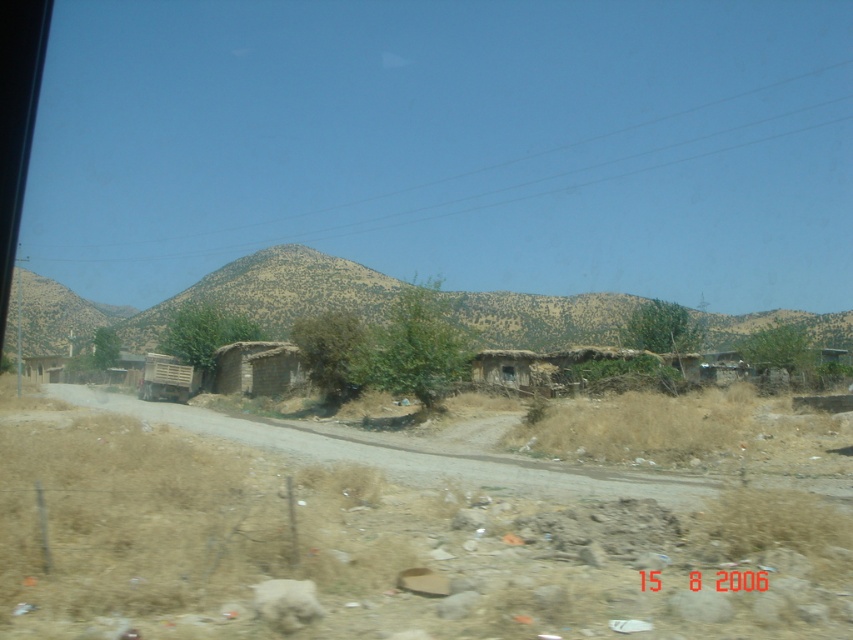
Question: Does brown textured mountain at center lie behind brown dirt track at center?

Choices:
 (A) yes
 (B) no

Answer: (A)

Question: Can you confirm if brown textured mountain at center is smaller than brown mud hut at center?

Choices:
 (A) no
 (B) yes

Answer: (A)

Question: Which object is the farthest from the brown dirt track at center?

Choices:
 (A) brown textured mountain at center
 (B) brown mud hut at center

Answer: (A)

Question: Which point appears farthest from the camera in this image?

Choices:
 (A) (332, 435)
 (B) (299, 364)

Answer: (B)

Question: Is brown dirt track at center positioned at the back of brown mud hut at center?

Choices:
 (A) no
 (B) yes

Answer: (A)

Question: Which of the following is the farthest from the observer?

Choices:
 (A) (254, 380)
 (B) (265, 435)

Answer: (A)